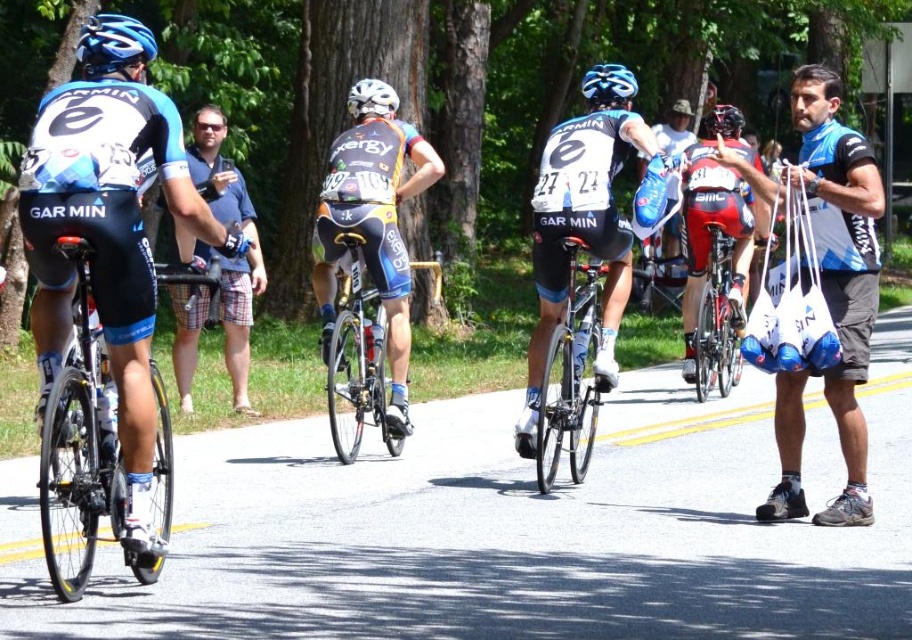
Consider the image. You are a photographer positioned at the center of the image. You want to take a photo of the blue jersey at right. Which direction should you move your camera to the right or left to capture it in the frame?

Since the blue jersey at right is located at point 0.455 on the x axis, which is to the right of the center point at 0.5, you should move your camera slightly to the left to capture the blue jersey at right in the frame.

You are a photographer at the cycling race. You want to capture a photo of both the shiny black frame at left and the shiny red bicycle at center in the same shot. Which bicycle should you focus on to ensure both are in frame?

You should focus on the shiny black frame at left because it is larger than the shiny red bicycle at center, so it will be easier to include both in the frame by centering on the larger object.